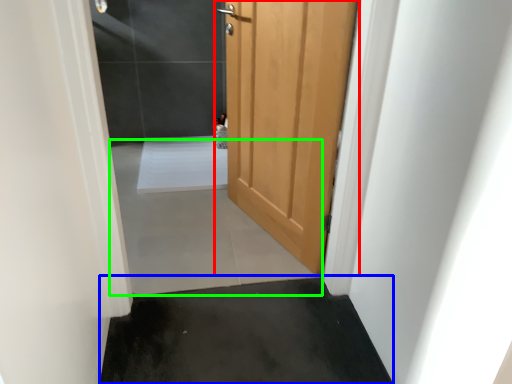
Question: Which is nearer to the door (highlighted by a red box)? concrete (highlighted by a blue box) or concrete (highlighted by a green box).

Choices:
 (A) concrete
 (B) concrete

Answer: (B)